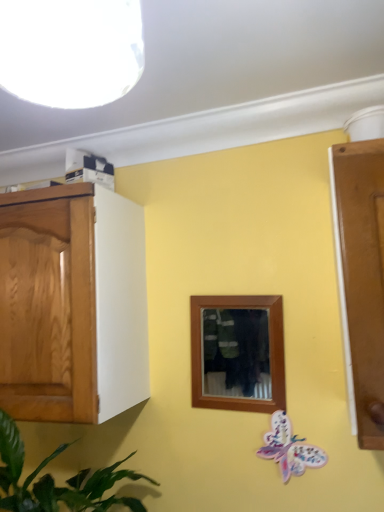
Describe the element at coordinates (70, 51) in the screenshot. I see `white glossy light fixture at upper left` at that location.

Where is `pastel paper butterfly at lower right`? This screenshot has width=384, height=512. pastel paper butterfly at lower right is located at coordinates (289, 448).

This screenshot has width=384, height=512. I want to click on houseplant lying on the left of pastel paper butterfly at lower right, so 54,482.

Is green leafy plant at left to the right of pastel paper butterfly at lower right from the viewer's perspective?

No.

Is green leafy plant at left far from pastel paper butterfly at lower right?

green leafy plant at left is near pastel paper butterfly at lower right, not far away.

From a real-world perspective, is green leafy plant at left above or below pastel paper butterfly at lower right?

green leafy plant at left is below pastel paper butterfly at lower right.

Does white glossy light fixture at upper left have a larger size compared to green leafy plant at left?

Actually, white glossy light fixture at upper left might be smaller than green leafy plant at left.

Consider the image. Would you consider white glossy light fixture at upper left to be distant from green leafy plant at left?

white glossy light fixture at upper left is actually quite close to green leafy plant at left.

From the image's perspective, is white glossy light fixture at upper left below green leafy plant at left?

Incorrect, from the image's perspective, white glossy light fixture at upper left is higher than green leafy plant at left.

Is white glossy light fixture at upper left spatially inside green leafy plant at left, or outside of it?

white glossy light fixture at upper left is located beyond the bounds of green leafy plant at left.

From a real-world perspective, is white glossy light fixture at upper left on top of pastel paper butterfly at lower right?

Correct, in the physical world, white glossy light fixture at upper left is higher than pastel paper butterfly at lower right.

Is pastel paper butterfly at lower right at the back of white glossy light fixture at upper left?

No, white glossy light fixture at upper left's orientation is not away from pastel paper butterfly at lower right.

Between white glossy light fixture at upper left and pastel paper butterfly at lower right, which one has smaller width?

With smaller width is pastel paper butterfly at lower right.

Is green leafy plant at left smaller than white glossy light fixture at upper left?

No.

Can white glossy light fixture at upper left be found inside green leafy plant at left?

Definitely not — white glossy light fixture at upper left is not inside green leafy plant at left.

Looking at their sizes, would you say green leafy plant at left is wider or thinner than white glossy light fixture at upper left?

Considering their sizes, green leafy plant at left looks broader than white glossy light fixture at upper left.

From the image's perspective, relative to white glossy light fixture at upper left, is green leafy plant at left above or below?

Based on their image positions, green leafy plant at left is located beneath white glossy light fixture at upper left.

Consider the image. Is pastel paper butterfly at lower right outside of white glossy light fixture at upper left?

Yes, pastel paper butterfly at lower right is outside of white glossy light fixture at upper left.

Considering the relative sizes of pastel paper butterfly at lower right and white glossy light fixture at upper left in the image provided, is pastel paper butterfly at lower right smaller than white glossy light fixture at upper left?

Yes, pastel paper butterfly at lower right is smaller than white glossy light fixture at upper left.

Is pastel paper butterfly at lower right closer to camera compared to white glossy light fixture at upper left?

No, the depth of pastel paper butterfly at lower right is greater than that of white glossy light fixture at upper left.

Are pastel paper butterfly at lower right and white glossy light fixture at upper left located far from each other?

Yes, pastel paper butterfly at lower right and white glossy light fixture at upper left are quite far apart.

Which object is positioned more to the right, pastel paper butterfly at lower right or green leafy plant at left?

From the viewer's perspective, pastel paper butterfly at lower right appears more on the right side.

Relative to green leafy plant at left, is pastel paper butterfly at lower right in front or behind?

pastel paper butterfly at lower right is positioned farther from the viewer than green leafy plant at left.

Considering the positions of point (297, 454) and point (90, 506), is point (297, 454) closer or farther from the camera than point (90, 506)?

Clearly, point (297, 454) is more distant from the camera than point (90, 506).

Locate an element on the screen. The height and width of the screenshot is (512, 384). butterfly located above the green leafy plant at left (from a real-world perspective) is located at coordinates (289, 448).

Locate an element on the screen. The width and height of the screenshot is (384, 512). houseplant located below the white glossy light fixture at upper left (from the image's perspective) is located at coordinates (54, 482).

Looking at the image, which one is located closer to pastel paper butterfly at lower right, white glossy light fixture at upper left or green leafy plant at left?

green leafy plant at left is closer to pastel paper butterfly at lower right.

Considering their positions, is pastel paper butterfly at lower right positioned further to white glossy light fixture at upper left than green leafy plant at left?

Based on the image, pastel paper butterfly at lower right appears to be further to white glossy light fixture at upper left.

From the image, which object appears to be farther from green leafy plant at left, pastel paper butterfly at lower right or white glossy light fixture at upper left?

Among the two, white glossy light fixture at upper left is located further to green leafy plant at left.

Which object lies nearer to the anchor point green leafy plant at left, white glossy light fixture at upper left or pastel paper butterfly at lower right?

pastel paper butterfly at lower right is closer to green leafy plant at left.

Consider the image. When comparing their distances from pastel paper butterfly at lower right, does green leafy plant at left or white glossy light fixture at upper left seem further?

white glossy light fixture at upper left lies further to pastel paper butterfly at lower right than the other object.

From the image, which object appears to be farther from white glossy light fixture at upper left, green leafy plant at left or pastel paper butterfly at lower right?

pastel paper butterfly at lower right lies further to white glossy light fixture at upper left than the other object.

At what (x,y) coordinates should I click in order to perform the action: click on butterfly between white glossy light fixture at upper left and green leafy plant at left in the vertical direction. Please return your answer as a coordinate pair (x, y). This screenshot has width=384, height=512. Looking at the image, I should click on (289, 448).